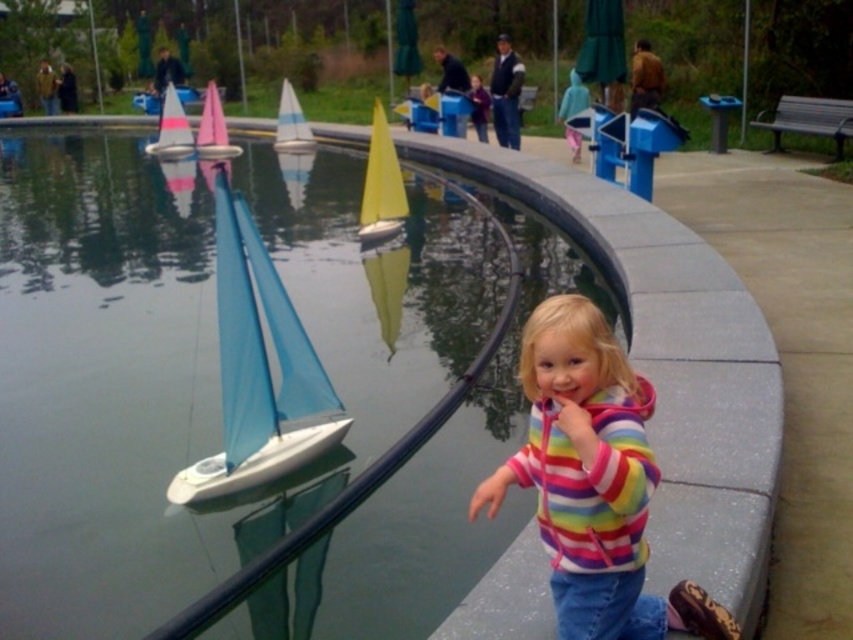
You are a child who wants to throw a stone to hit the pink matte sailboat at upper left and the blue matte sailboat at center. Which one do you need to throw the stone farther to hit?

The pink matte sailboat at upper left is larger in size compared to the blue matte sailboat at center. However, the question asks about the distance needed to throw the stone. Since the pink sailboat is at the upper left and the blue one is at the center, their positions might indicate their distance from the child. But the Objects Description only mentions size, not distance. Therefore, based on the given information, we cannot determine which requires a farther throw. The answer should state that the size

You are a photographer trying to capture both the blue fabric sailboat at left and the blue matte sailboat at center in a single shot. Which boat will appear closer to the camera in your photo?

The blue fabric sailboat at left will appear closer to the camera in the photo because it is positioned in front of the blue matte sailboat at center.

You are a child at the park and want to throw a pebble to make a splash between the blue fabric sailboat at left and the pink matte sailboat at upper left. Which boat should you aim closer to if you want the splash to be between them?

The blue fabric sailboat at left is positioned on the right side of pink matte sailboat at upper left. To make the splash between them, aim closer to the blue fabric sailboat at left since it is positioned to the right of the pink one, creating a space between them.